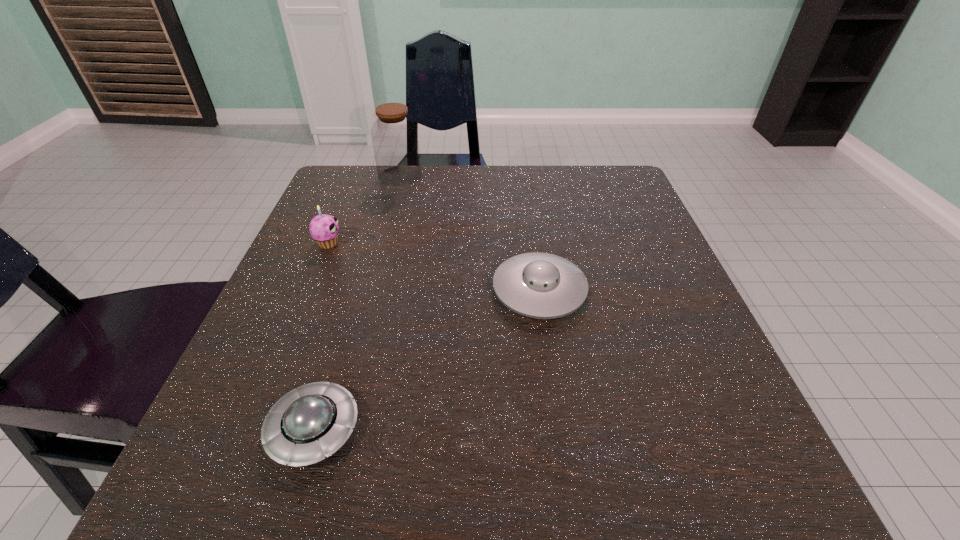
Image resolution: width=960 pixels, height=540 pixels. In order to click on vacant area between the left saucer and the rightmost object in this screenshot , I will do `click(426, 360)`.

Identify the location of vacant space that's between the left saucer and the jar. click(357, 302).

What are the coordinates of `empty space between the nearer saucer and the rightmost object` in the screenshot? It's located at (426, 360).

I want to click on free space between the third farthest object and the cupcake, so click(434, 267).

I want to click on free space between the left saucer and the second tallest object, so click(322, 336).

This screenshot has width=960, height=540. Identify the location of free spot between the second tallest object and the jar. (364, 210).

Where is `object that is the closest to the cupcake`? object that is the closest to the cupcake is located at coordinates (394, 136).

Locate an element on the screen. object identified as the closest to the second farthest object is located at coordinates (394, 136).

This screenshot has height=540, width=960. Find the location of `free space that satisfies the following two spatial constraints: 1. on the back side of the nearest object; 2. on the left side of the jar`. free space that satisfies the following two spatial constraints: 1. on the back side of the nearest object; 2. on the left side of the jar is located at coordinates (391, 176).

Find the location of a particular element. free space in the image that satisfies the following two spatial constraints: 1. on the face of the third shortest object; 2. on the back side of the nearest object is located at coordinates (251, 429).